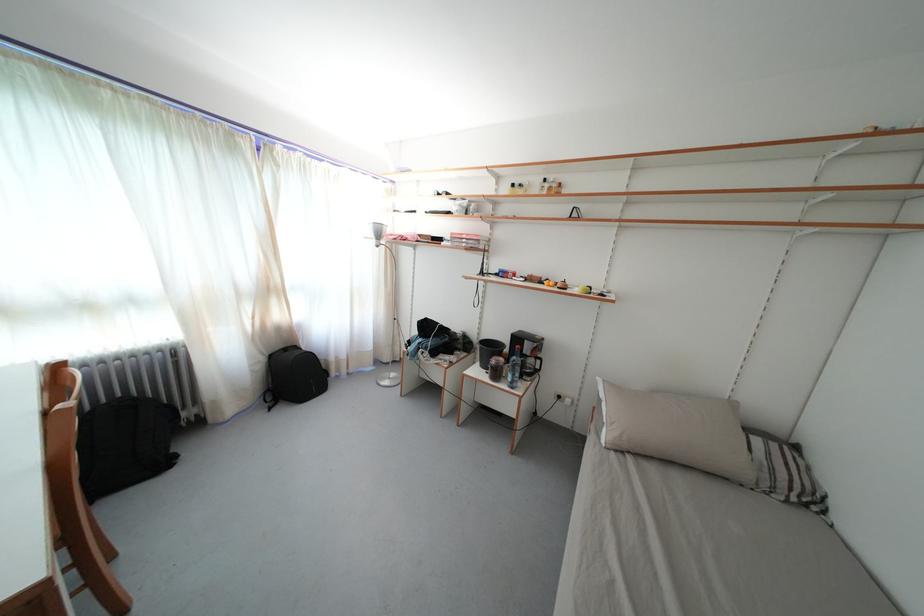
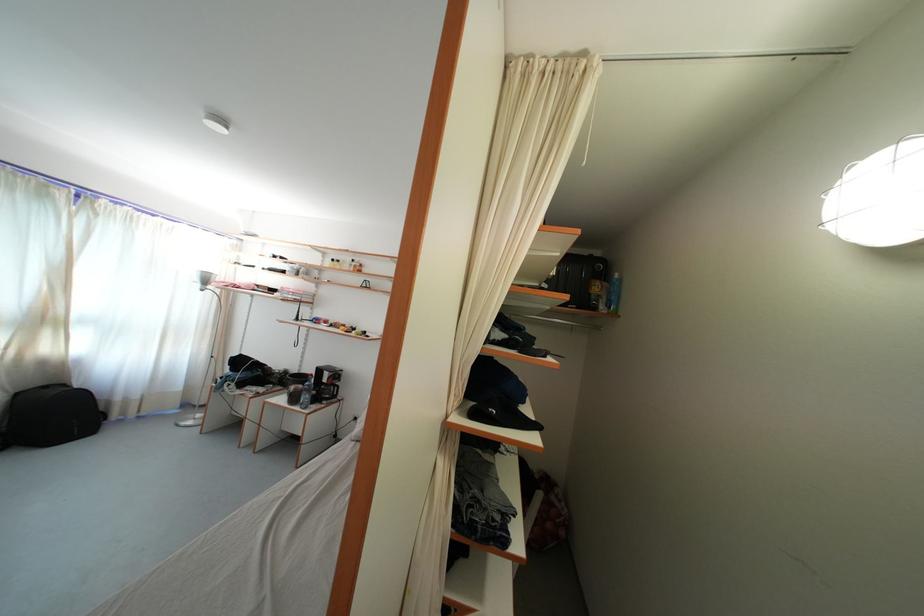
Where in the second image is the point corresponding to (x=349, y=362) from the first image?

(141, 403)